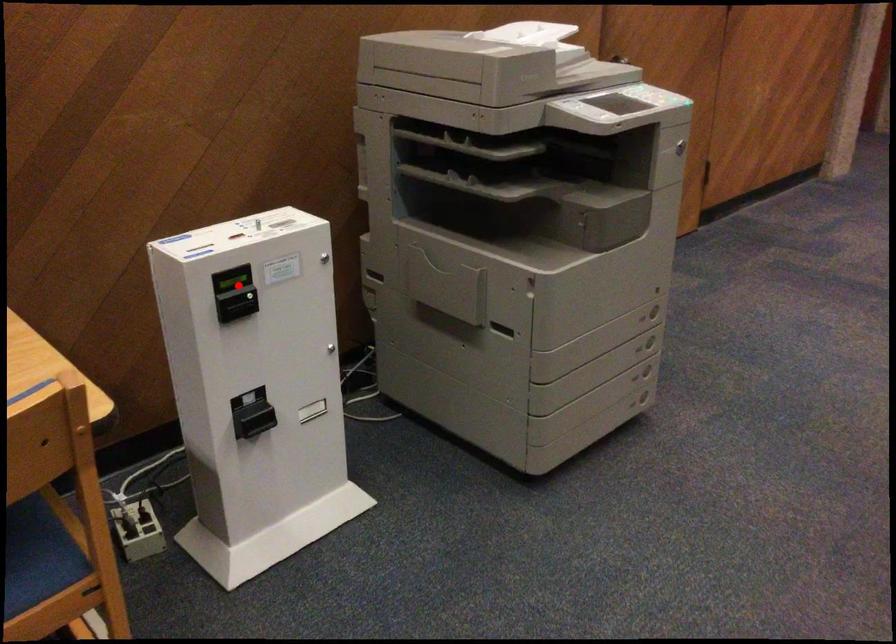
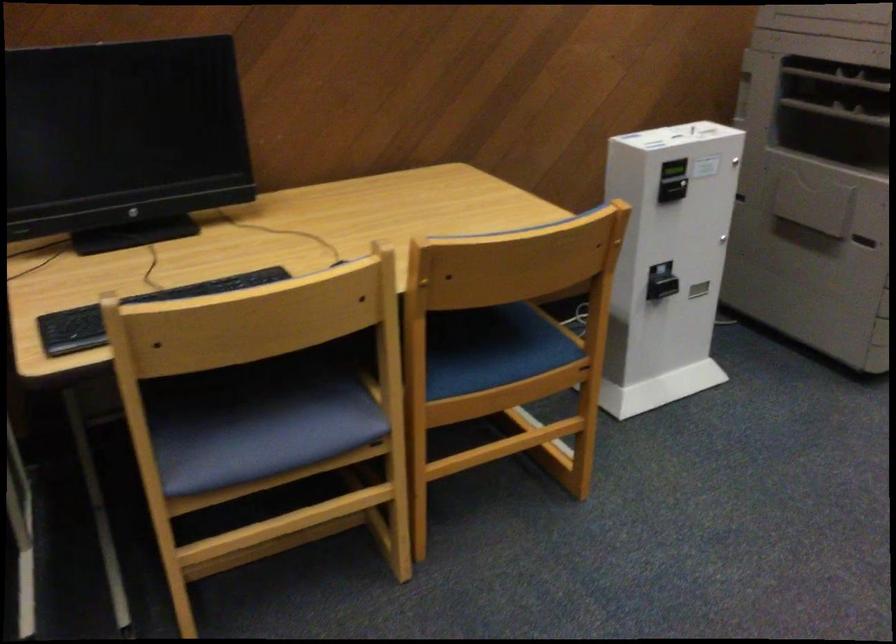
Find the pixel in the second image that matches the highlighted location in the first image.

(673, 169)